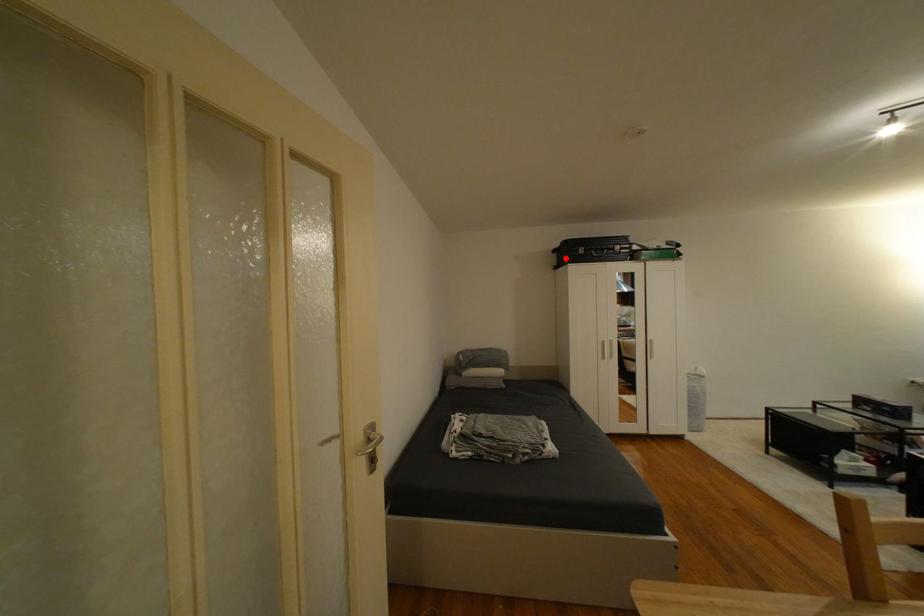
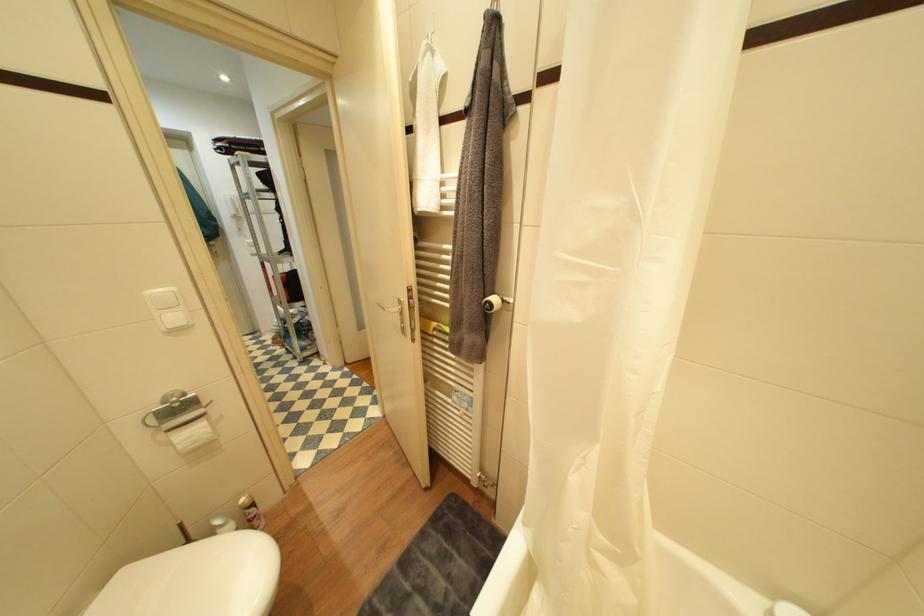
Question: I am providing you with two images of the same scene from different viewpoints. A red point is marked on the first image. Can you still see the location of the red point in image 2?

Choices:
 (A) Yes
 (B) No

Answer: (B)